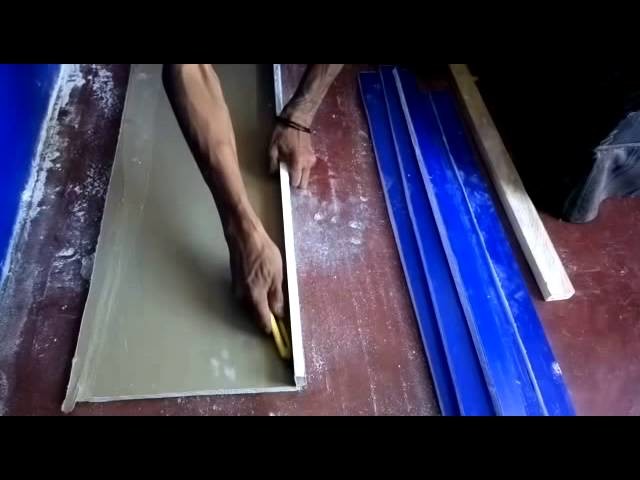
In order to click on floor in this screenshot , I will do `click(355, 310)`.